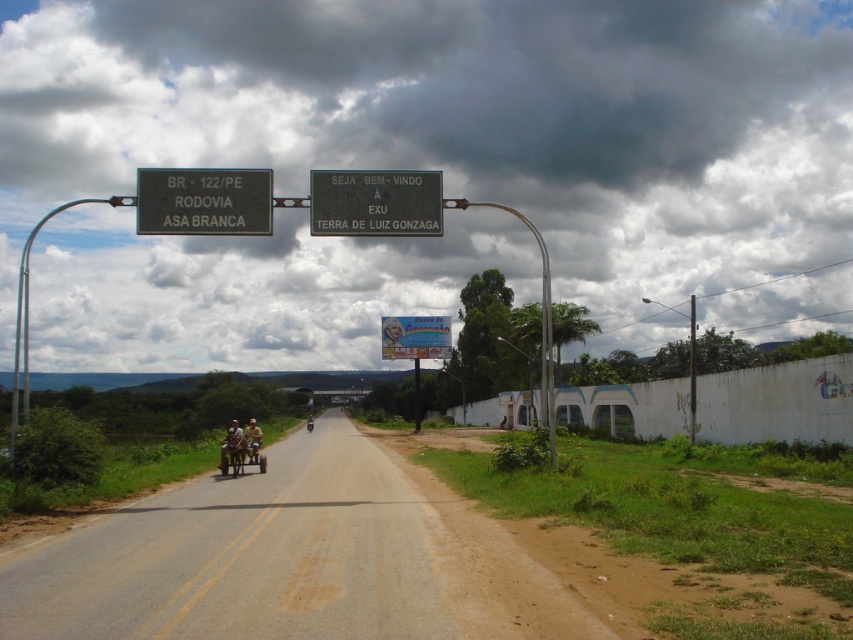
You are driving a car and see the black metal sign at upper center and the wooden cart at center on the road. Which object is higher from the ground?

The black metal sign at upper center is above the wooden cart at center, so it is higher from the ground.

You are driving a car and see the brown dirt track at center and the camouflage fabric shirt at center in your path. Which object is closer to your car?

The camouflage fabric shirt at center is closer to your car because the brown dirt track at center is positioned over it, indicating it is further away.

You are driving a car and see the blue plastic billboard at center and the wooden cart at center on the road. Which object is higher from the ground?

The blue plastic billboard at center is above the wooden cart at center, so it is higher from the ground.